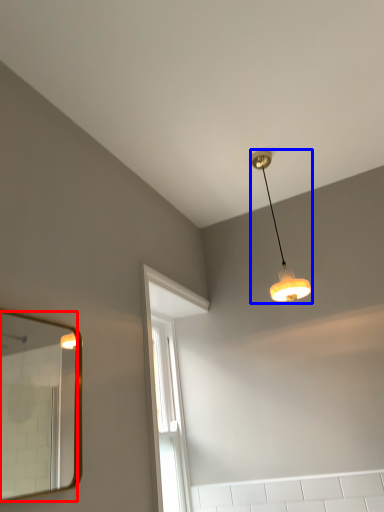
Question: Which object is further to the camera taking this photo, mirror (highlighted by a red box) or lamp (highlighted by a blue box)?

Choices:
 (A) mirror
 (B) lamp

Answer: (B)